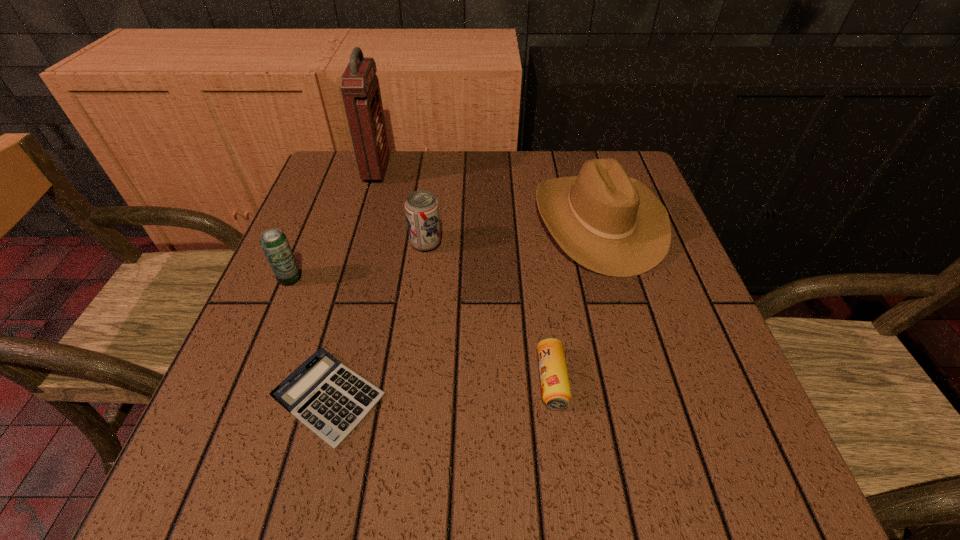
This screenshot has width=960, height=540. I want to click on vacant space at the near right corner, so (668, 494).

Locate an element on the screen. free point between the farthest beer can and the calculator is located at coordinates (377, 321).

Locate an element on the screen. The height and width of the screenshot is (540, 960). free area in between the shortest object and the first-aid kit is located at coordinates (353, 284).

The width and height of the screenshot is (960, 540). I want to click on empty location between the cowboy hat and the second farthest beer can, so click(444, 249).

Image resolution: width=960 pixels, height=540 pixels. Find the location of `vacant space in between the cowboy hat and the second farthest beer can`. vacant space in between the cowboy hat and the second farthest beer can is located at coordinates (444, 249).

This screenshot has height=540, width=960. I want to click on free point between the leftmost beer can and the calculator, so click(309, 338).

You are a GUI agent. You are given a task and a screenshot of the screen. Output one action in this format:
    pyautogui.click(x=<x>, y=<y>)
    Task: Click on the free space between the shortest object and the cowboy hat
    This screenshot has height=540, width=960.
    Given the screenshot: What is the action you would take?
    pyautogui.click(x=464, y=309)

Where is `free spot between the farthest beer can and the leftmost object`? The height and width of the screenshot is (540, 960). free spot between the farthest beer can and the leftmost object is located at coordinates (358, 261).

Find the location of a particular element. This screenshot has height=540, width=960. vacant area that lies between the calculator and the tallest object is located at coordinates (353, 284).

Where is `empty space that is in between the farthest beer can and the tallest object`? empty space that is in between the farthest beer can and the tallest object is located at coordinates (401, 206).